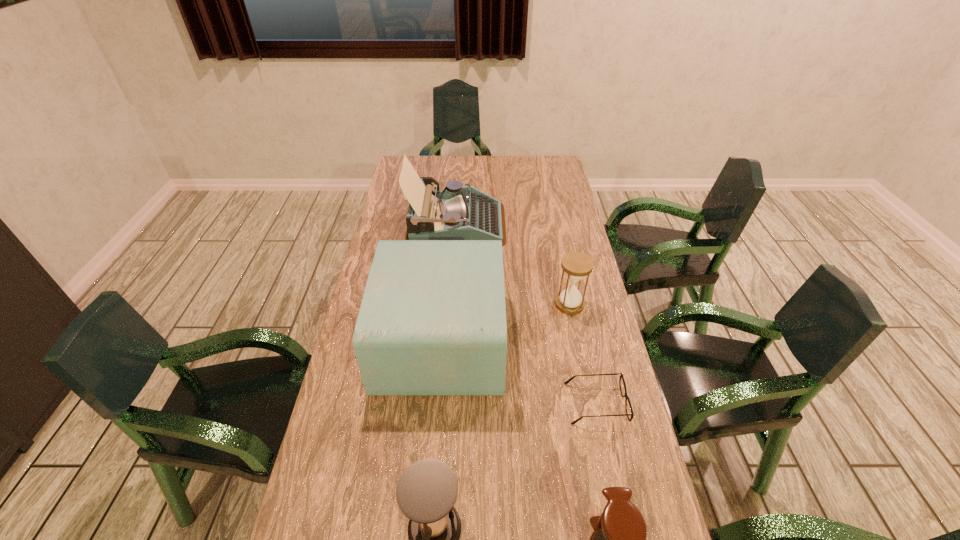
The image size is (960, 540). I want to click on the farthest object, so click(x=456, y=213).

At what (x,y) coordinates should I click in order to perform the action: click on radio receiver. Please return your answer as a coordinate pair (x, y). This screenshot has height=540, width=960. Looking at the image, I should click on (432, 322).

Identify the location of the farthest hourglass. This screenshot has height=540, width=960. (576, 265).

The height and width of the screenshot is (540, 960). I want to click on the shortest object, so click(631, 414).

Locate an element on the screen. free location located on the typing side of the typewriter is located at coordinates (564, 224).

Locate an element on the screen. The image size is (960, 540). vacant space situated 0.170m on the front panel of the radio receiver is located at coordinates (563, 340).

The width and height of the screenshot is (960, 540). I want to click on free space located on the back of the farthest hourglass, so click(x=561, y=259).

The height and width of the screenshot is (540, 960). Identify the location of vacant space situated with the lenses facing outward on the spectacles. (483, 403).

Image resolution: width=960 pixels, height=540 pixels. In order to click on vacant area situated with the lenses facing outward on the spectacles in this screenshot , I will do `click(531, 403)`.

At what (x,y) coordinates should I click in order to perform the action: click on free space located with the lenses facing outward on the spectacles. Please return your answer as a coordinate pair (x, y). The image size is (960, 540). Looking at the image, I should click on (527, 403).